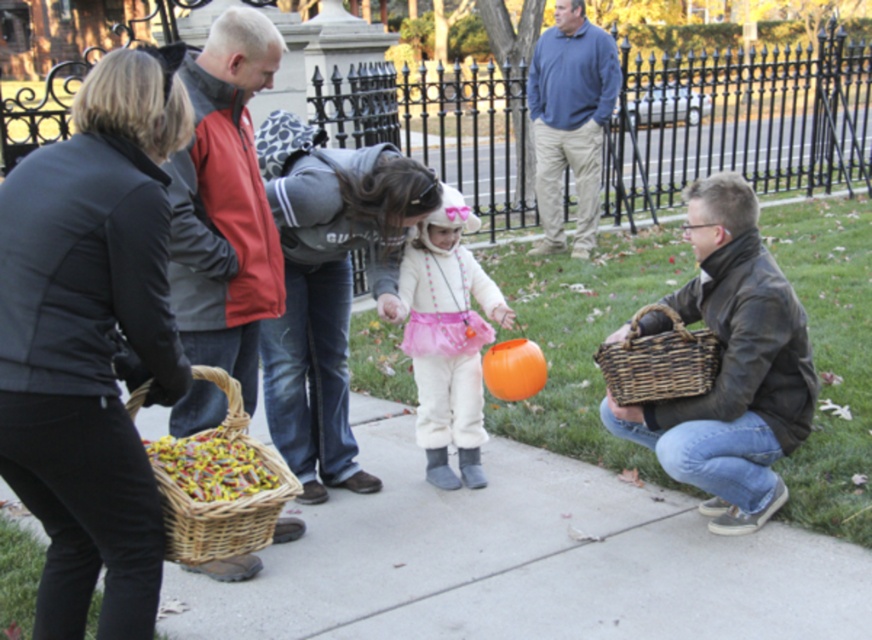
Who is lower down, blue cotton shirt at upper right or woven brown basket at lower right?

woven brown basket at lower right is lower down.

This screenshot has height=640, width=872. Describe the element at coordinates (570, 120) in the screenshot. I see `blue cotton shirt at upper right` at that location.

The image size is (872, 640). I want to click on blue cotton shirt at upper right, so click(570, 120).

Is red jacket at center further to the viewer compared to woven brown basket at lower right?

No.

Which is more to the right, red jacket at center or woven brown basket at lower right?

woven brown basket at lower right is more to the right.

Between point (267, 314) and point (630, 364), which one is positioned behind?

The point (630, 364) is more distant.

What are the coordinates of `red jacket at center` in the screenshot? It's located at (225, 204).

Is point (312, 577) positioned after point (673, 324)?

No, (312, 577) is closer to viewer.

Between smooth concrete sidewalk at center and woven brown basket at lower right, which one has less height?

woven brown basket at lower right is shorter.

Is point (448, 557) behind point (709, 360)?

Yes, it is behind point (709, 360).

This screenshot has height=640, width=872. What are the coordinates of `smooth concrete sidewalk at center` in the screenshot? It's located at (522, 561).